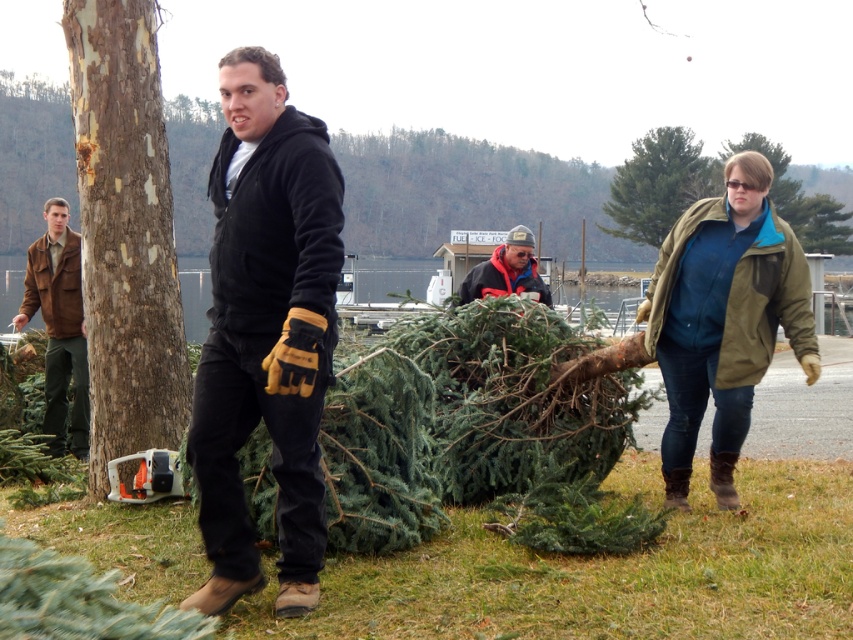
Question: Among these objects, which one is farthest from the camera?

Choices:
 (A) brown suede jacket at left
 (B) smooth brown bark at left

Answer: (A)

Question: Does black fleece hoodie at center appear over reddish-brown woolen jacket at center?

Choices:
 (A) yes
 (B) no

Answer: (B)

Question: Is black fleece hoodie at center bigger than smooth brown bark at left?

Choices:
 (A) yes
 (B) no

Answer: (B)

Question: Among these points, which one is nearest to the camera?

Choices:
 (A) (57, 374)
 (B) (677, 150)

Answer: (A)

Question: Which point is farther from the camera taking this photo?

Choices:
 (A) (49, 401)
 (B) (285, 492)
 (C) (125, 422)
 (D) (463, 301)

Answer: (A)

Question: Can you confirm if brown suede jacket at left is positioned to the right of green matte tree at upper right?

Choices:
 (A) yes
 (B) no

Answer: (B)